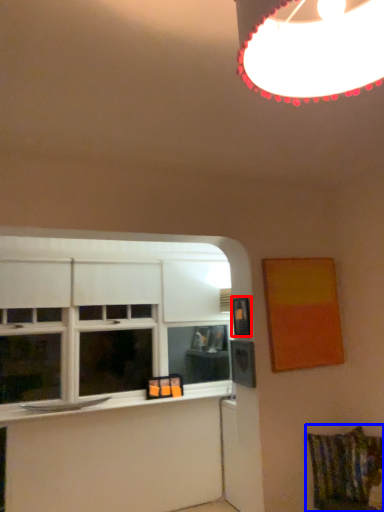
Question: Which point is closer to the camera, picture frame (highlighted by a red box) or swivel chair (highlighted by a blue box)?

Choices:
 (A) picture frame
 (B) swivel chair

Answer: (B)